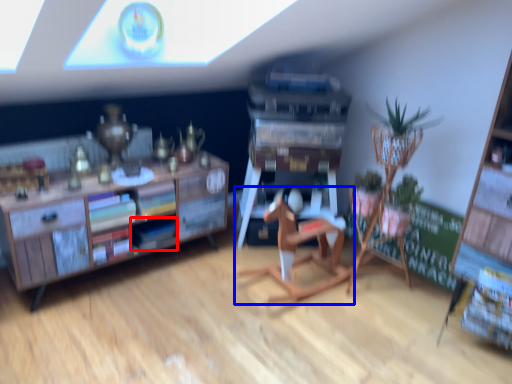
Question: Among these objects, which one is nearest to the camera, book (highlighted by a red box) or chair (highlighted by a blue box)?

Choices:
 (A) book
 (B) chair

Answer: (B)